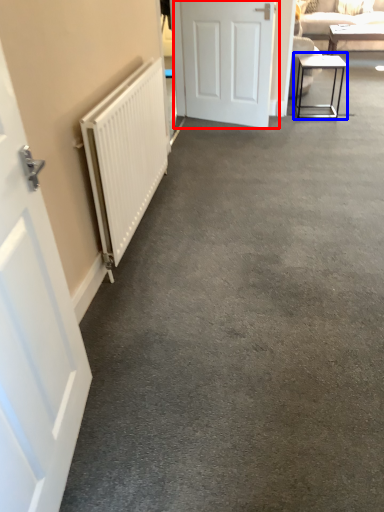
Question: Which of the following is the farthest to the observer, door (highlighted by a red box) or table (highlighted by a blue box)?

Choices:
 (A) door
 (B) table

Answer: (B)